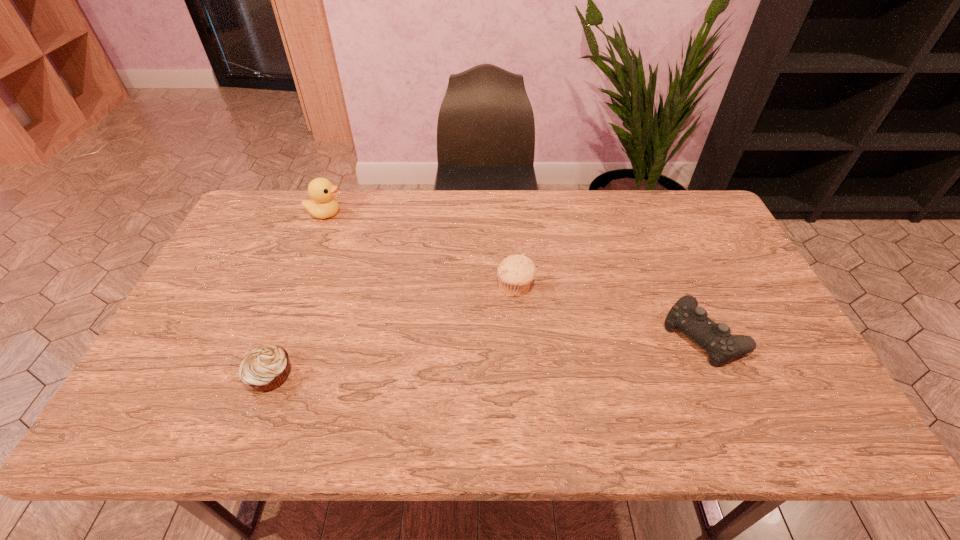
This screenshot has width=960, height=540. I want to click on free point located 0.120m on the left of the control, so click(617, 334).

Identify the location of object that is at the far edge. The height and width of the screenshot is (540, 960). (323, 205).

Where is `object at the right edge`? object at the right edge is located at coordinates (715, 338).

Where is `vacant space at the far edge of the desktop`? This screenshot has height=540, width=960. vacant space at the far edge of the desktop is located at coordinates (631, 211).

In the image, there is a desktop. Identify the location of vacant space at the near edge. (386, 437).

In order to click on vacant space at the left edge in this screenshot , I will do `click(231, 308)`.

Where is `vacant region at the right edge of the desktop`? This screenshot has height=540, width=960. vacant region at the right edge of the desktop is located at coordinates (687, 254).

Image resolution: width=960 pixels, height=540 pixels. What are the coordinates of `vacant space at the far left corner of the desktop` in the screenshot? It's located at (290, 212).

The image size is (960, 540). Identify the location of free space at the far right corner. (687, 192).

Locate an element on the screen. Image resolution: width=960 pixels, height=540 pixels. free space between the shorter muffin and the third shortest object is located at coordinates (394, 332).